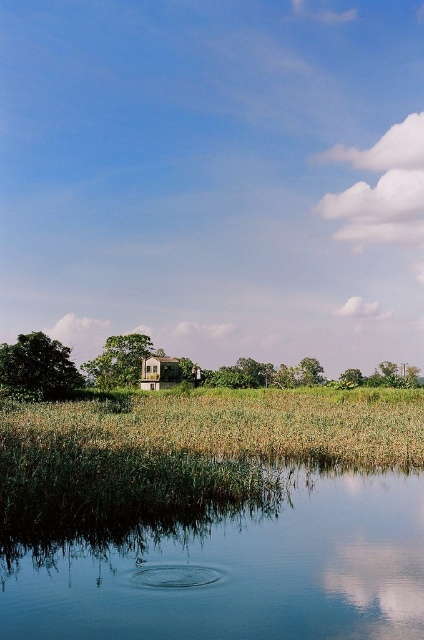
Question: Which object is farther from the camera taking this photo?

Choices:
 (A) wooden hut at center
 (B) transparent glass water at lower center

Answer: (A)

Question: Which of the following is the closest to the observer?

Choices:
 (A) wooden hut at center
 (B) transparent glass water at lower center
 (C) green grassy field at center

Answer: (B)

Question: Is transparent glass water at lower center bigger than green grassy field at center?

Choices:
 (A) yes
 (B) no

Answer: (B)

Question: Is green grassy field at center above wooden hut at center?

Choices:
 (A) yes
 (B) no

Answer: (A)

Question: Which point appears farthest from the camera in this image?

Choices:
 (A) (262, 598)
 (B) (170, 362)
 (C) (370, 419)

Answer: (B)

Question: Is the position of transparent glass water at lower center more distant than that of wooden hut at center?

Choices:
 (A) yes
 (B) no

Answer: (B)